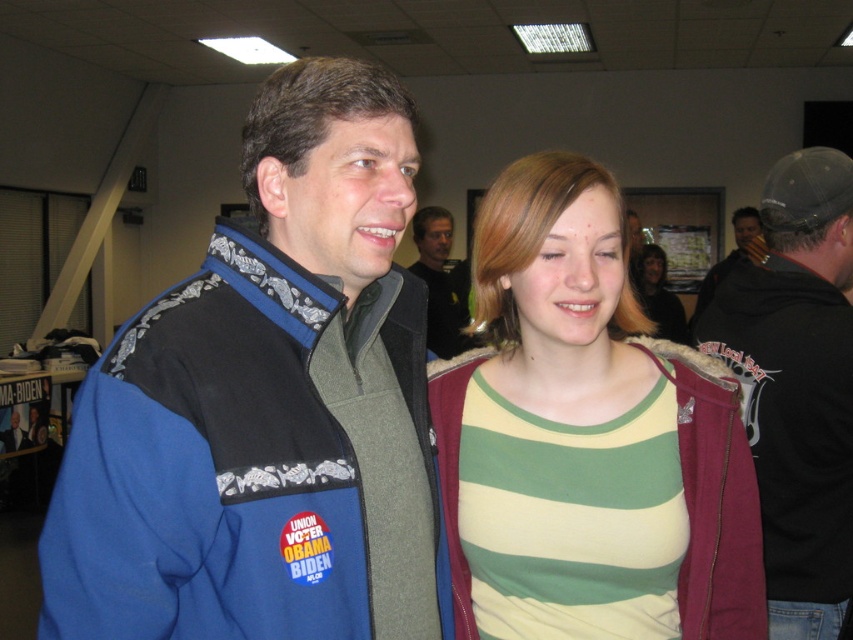
Question: Estimate the real-world distances between objects in this image. Which object is closer to the black hoodie at right?

Choices:
 (A) blue fleece jacket at center
 (B) striped cotton shirt at center

Answer: (B)

Question: Is blue fleece jacket at center to the right of dark gray textured jacket at right from the viewer's perspective?

Choices:
 (A) yes
 (B) no

Answer: (B)

Question: Is black hoodie at right further to the viewer compared to dark gray textured jacket at right?

Choices:
 (A) no
 (B) yes

Answer: (A)

Question: Is blue fleece jacket at center behind striped cotton shirt at center?

Choices:
 (A) no
 (B) yes

Answer: (A)

Question: Among these points, which one is farthest from the camera?

Choices:
 (A) (318, 272)
 (B) (607, 365)
 (C) (740, 212)
 (D) (428, 262)

Answer: (C)

Question: Which point is farther to the camera?

Choices:
 (A) coord(270,460)
 (B) coord(585,292)
 (C) coord(718,269)
 (D) coord(759,349)

Answer: (C)